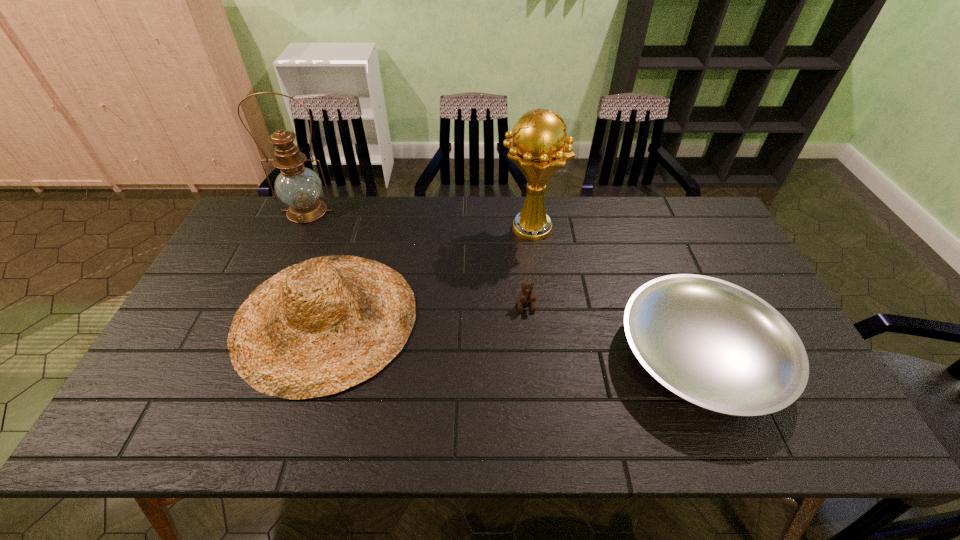
The width and height of the screenshot is (960, 540). In order to click on vacant area situated 0.060m on the back of the rightmost object in this screenshot , I will do 669,279.

The width and height of the screenshot is (960, 540). I want to click on vacant area located on the face of the teddy bear, so click(530, 348).

Where is `oil lamp located in the far edge section of the desktop`? The height and width of the screenshot is (540, 960). oil lamp located in the far edge section of the desktop is located at coordinates (299, 187).

The image size is (960, 540). I want to click on trophy_cup present at the far edge, so click(x=540, y=147).

This screenshot has width=960, height=540. In order to click on object located at the near edge in this screenshot , I will do `click(712, 343)`.

Identify the location of oil lamp that is positioned at the left edge. (299, 187).

You are a GUI agent. You are given a task and a screenshot of the screen. Output one action in this format:
    pyautogui.click(x=<x>, y=<y>)
    Task: Click on the sunhat at the left edge
    This screenshot has height=540, width=960.
    Given the screenshot: What is the action you would take?
    pyautogui.click(x=316, y=328)

Where is `object present at the right edge`? The width and height of the screenshot is (960, 540). object present at the right edge is located at coordinates (712, 343).

Where is `object positioned at the far left corner`? The height and width of the screenshot is (540, 960). object positioned at the far left corner is located at coordinates (299, 187).

Locate an element on the screen. This screenshot has width=960, height=540. object that is at the near right corner is located at coordinates (712, 343).